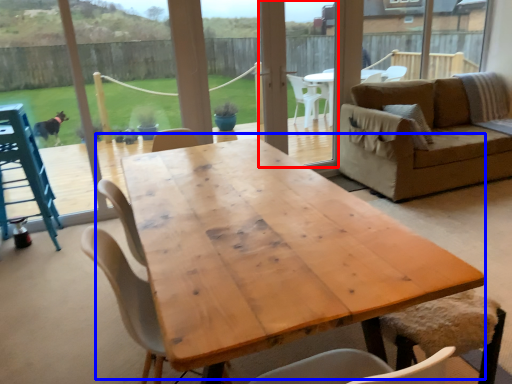
Question: Which point is closer to the camera, screen door (highlighted by a red box) or coffee table (highlighted by a blue box)?

Choices:
 (A) screen door
 (B) coffee table

Answer: (B)